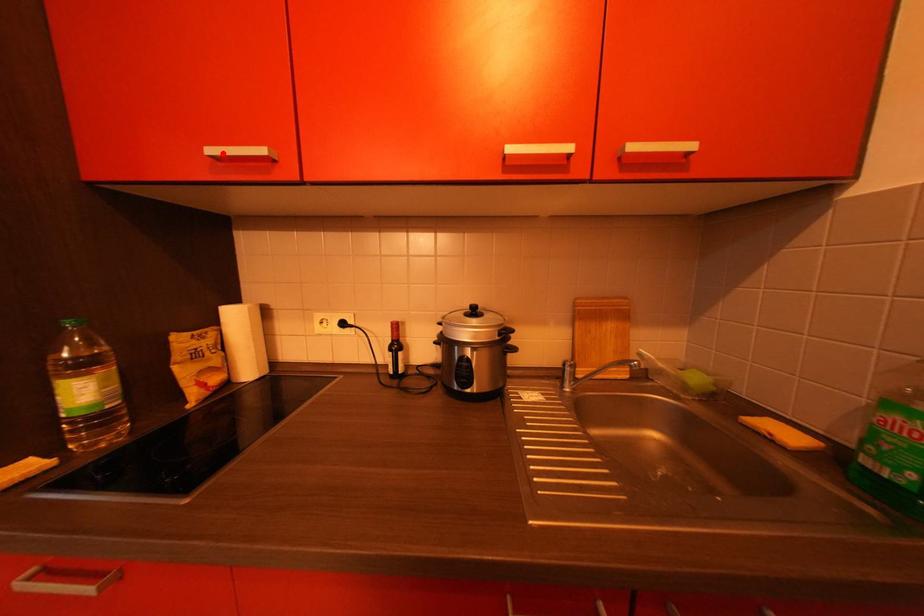
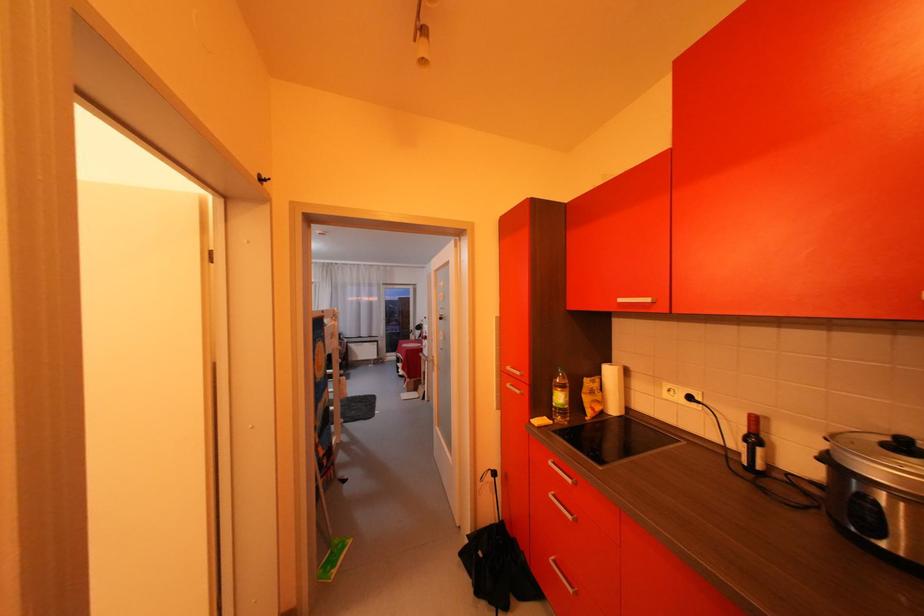
Question: I am providing you with two images of the same scene from different viewpoints. A red point is marked on the first image. At the location where the point appears in image 1, is it still visible in image 2?

Choices:
 (A) Yes
 (B) No

Answer: (A)